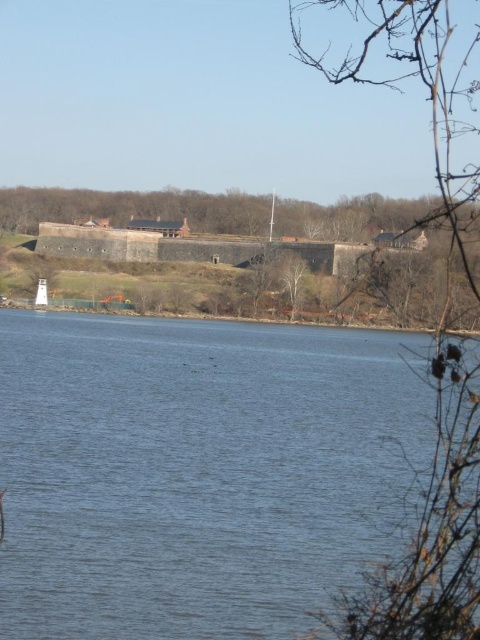
In the scene shown: Who is shorter, brown wooden tree at center or bare branches at center?

bare branches at center

Does brown wooden tree at center appear under bare branches at center?

Actually, brown wooden tree at center is above bare branches at center.

This screenshot has height=640, width=480. I want to click on brown wooden tree at center, so coord(135,209).

You are a GUI agent. You are given a task and a screenshot of the screen. Output one action in this format:
    pyautogui.click(x=<x>, y=<y>)
    Task: Click on the brown wooden tree at center
    
    Given the screenshot: What is the action you would take?
    pyautogui.click(x=135, y=209)

Which is above, bare branches at right or brown wooden tree at center?

bare branches at right is higher up.

Where is `bare branches at right`? This screenshot has height=640, width=480. bare branches at right is located at coordinates (435, 524).

The image size is (480, 640). In order to click on bare branches at right in this screenshot , I will do `click(435, 524)`.

Consider the image. Can you confirm if blue water at center is bigger than brown wooden tree at center?

No, blue water at center is not bigger than brown wooden tree at center.

Looking at this image, measure the distance between point (362, 449) and camera.

Point (362, 449) is 40.62 meters away from camera.

At what (x,y) coordinates should I click in order to perform the action: click on blue water at center. Please return your answer as a coordinate pair (x, y). Looking at the image, I should click on (199, 472).